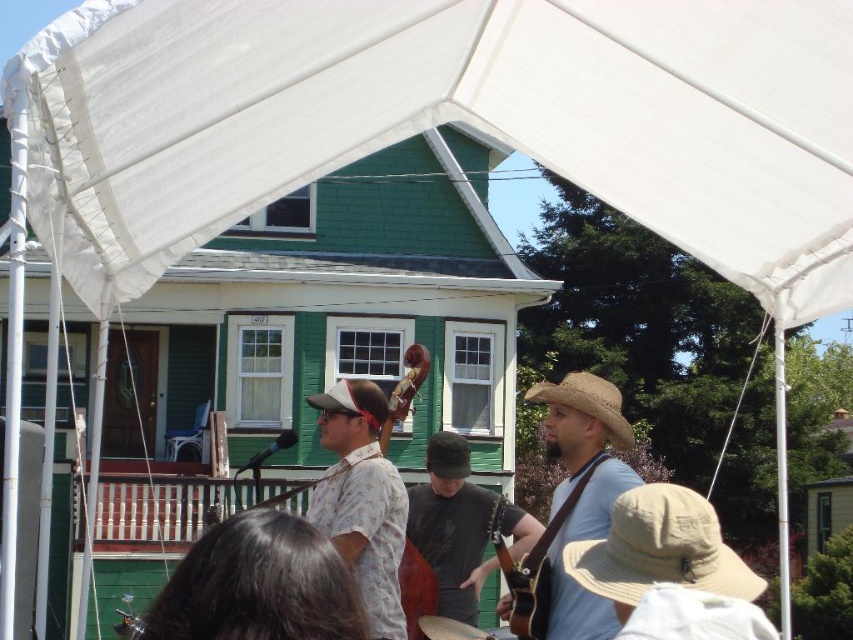
Can you confirm if floral shirt at center is bigger than matte brown cello at center?

Indeed, floral shirt at center has a larger size compared to matte brown cello at center.

Does floral shirt at center appear on the right side of matte brown cello at center?

In fact, floral shirt at center is to the left of matte brown cello at center.

Which is behind, point (374, 589) or point (410, 369)?

The point (410, 369) is behind.

Where is `floral shirt at center`? The image size is (853, 640). floral shirt at center is located at coordinates (363, 499).

Which of these two, white fabric canopy at upper center or wooden acoustic guitar at lower right, stands taller?

white fabric canopy at upper center is taller.

Identify the location of white fabric canopy at upper center. (461, 120).

Describe the element at coordinates (461, 120) in the screenshot. The width and height of the screenshot is (853, 640). I see `white fabric canopy at upper center` at that location.

Locate an element on the screen. The height and width of the screenshot is (640, 853). white fabric canopy at upper center is located at coordinates (461, 120).

Between floral shirt at center and brown straw hat at center, which one has less height?

Standing shorter between the two is brown straw hat at center.

What do you see at coordinates (363, 499) in the screenshot? I see `floral shirt at center` at bounding box center [363, 499].

The height and width of the screenshot is (640, 853). I want to click on floral shirt at center, so click(363, 499).